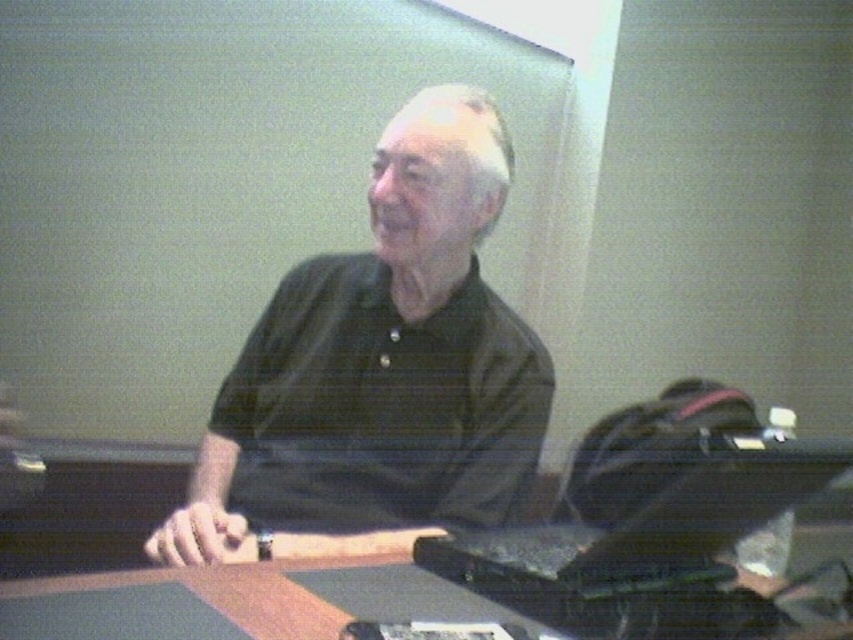
You are a fashion designer analyzing the image. You need to determine the exact location of the black matte shirt at center. Can you confirm if it is positioned at the coordinates point (386, 355)?

Yes, the black matte shirt at center is located exactly at point (386, 355) as specified.

You are trying to place a 10 cm tall object on the table. Given the black textured laptop at center and the smooth wooden table at center, will the object fit without being obstructed by the laptop?

The black textured laptop at center is taller than the smooth wooden table at center. Since the laptop is taller than the table surface, placing a 10 cm tall object might still be possible if there is enough space around the laptop, but the height of the laptop itself could obstruct the object depending on placement.

What object is located at the coordinates point (650, 520) in the image?

The black textured laptop at center is located at point (650, 520).